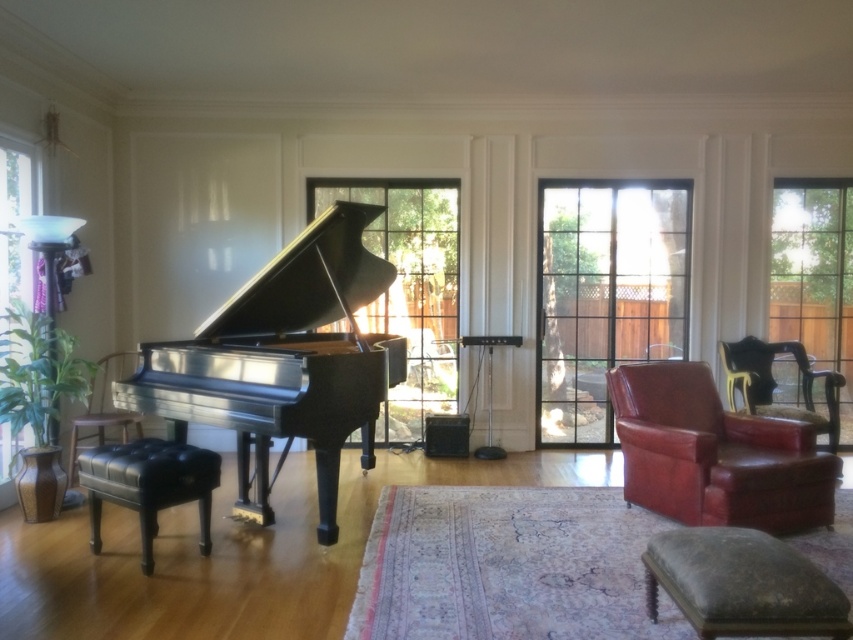
Which is in front, point (656, 490) or point (103, 419)?

Positioned in front is point (656, 490).

At what (x,y) coordinates should I click in order to perform the action: click on matte leather armchair at right. Please return your answer as a coordinate pair (x, y). The width and height of the screenshot is (853, 640). Looking at the image, I should click on (715, 454).

At what (x,y) coordinates should I click in order to perform the action: click on matte leather armchair at right. Please return your answer as a coordinate pair (x, y). This screenshot has height=640, width=853. Looking at the image, I should click on (715, 454).

Locate an element on the screen. This screenshot has width=853, height=640. matte leather armchair at right is located at coordinates (715, 454).

Is clear glass window at center wider than dark brown leather ottoman at lower right?

Yes, clear glass window at center is wider than dark brown leather ottoman at lower right.

Is clear glass window at center behind dark brown leather ottoman at lower right?

Yes, it is.

Identify the location of clear glass window at center. (410, 285).

At what (x,y) coordinates should I click in order to perform the action: click on clear glass window at center. Please return your answer as a coordinate pair (x, y). The image size is (853, 640). Looking at the image, I should click on (410, 285).

Who is more forward, (364, 392) or (640, 440)?

Positioned in front is point (364, 392).

Can you confirm if shiny black piano at left is wider than matte leather armchair at right?

Indeed, shiny black piano at left has a greater width compared to matte leather armchair at right.

Between point (357, 397) and point (750, 429), which one is positioned in front?

Point (357, 397) is in front.

Locate an element on the screen. The width and height of the screenshot is (853, 640). shiny black piano at left is located at coordinates (283, 360).